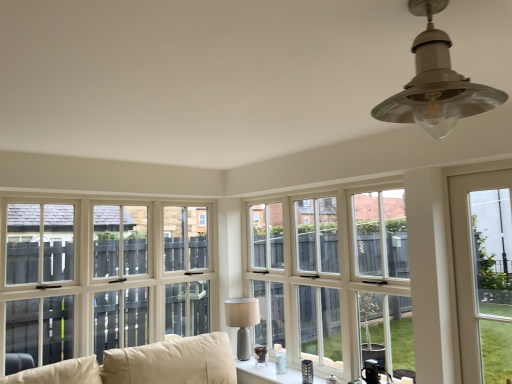
Measure the distance between beige fabric couch at lower left and camera.

A distance of 8.93 feet exists between beige fabric couch at lower left and camera.

This screenshot has width=512, height=384. What do you see at coordinates (145, 365) in the screenshot?
I see `beige fabric couch at lower left` at bounding box center [145, 365].

What is the approximate width of clear glass door at right, the 1th window viewed from the right?

It is 1.63 inches.

Find the location of a particular element. The image size is (512, 384). matte gray lamp at center, acting as the first lamp starting from the bottom is located at coordinates (242, 322).

Based on the photo, is white glossy windowsill at center, marked as the third window in a right-to-left arrangement, positioned behind matte gray lamp at center, the 1th lamp when ordered from back to front?

No, it is in front of matte gray lamp at center, the 1th lamp when ordered from back to front.

Considering the sizes of objects white glossy windowsill at center, marked as the third window in a right-to-left arrangement, and matte gray lamp at center, which ranks as the second lamp in front-to-back order, in the image provided, who is smaller, white glossy windowsill at center, marked as the third window in a right-to-left arrangement, or matte gray lamp at center, which ranks as the second lamp in front-to-back order,?

Smaller between the two is white glossy windowsill at center, marked as the third window in a right-to-left arrangement.

Are white glossy windowsill at center, placed as the first window when sorted from left to right, and matte gray lamp at center, the 2th lamp in the right-to-left sequence, far apart?

That's not correct — white glossy windowsill at center, placed as the first window when sorted from left to right, is a little close to matte gray lamp at center, the 2th lamp in the right-to-left sequence.

Which is less distant, (271, 380) or (248, 345)?

Point (271, 380)

Can you confirm if beige fabric couch at lower left is bigger than matte gray lamp at center, acting as the first lamp starting from the bottom?

Yes.

From their relative heights in the image, would you say beige fabric couch at lower left is taller or shorter than matte gray lamp at center, which is the second lamp from top to bottom?

In the image, beige fabric couch at lower left appears to be shorter than matte gray lamp at center, which is the second lamp from top to bottom.

Is beige fabric couch at lower left aimed at matte gray lamp at center, acting as the first lamp starting from the bottom?

No, beige fabric couch at lower left is not facing towards matte gray lamp at center, acting as the first lamp starting from the bottom.

Is the position of matte gray lamp at center, which is the second lamp from top to bottom, less distant than that of white glossy windowsill at center, placed as the first window when sorted from left to right?

No, it is not.

Is matte gray lamp at center, the 1th lamp when ordered from back to front, aimed at white glossy windowsill at center, marked as the third window in a right-to-left arrangement?

Yes, matte gray lamp at center, the 1th lamp when ordered from back to front, is turned towards white glossy windowsill at center, marked as the third window in a right-to-left arrangement.

Who is taller, matte gray lamp at center, acting as the first lamp starting from the bottom, or white glossy windowsill at center, placed as the first window when sorted from left to right?

matte gray lamp at center, acting as the first lamp starting from the bottom.

From the image's perspective, starting from the white glossy windowsill at center, marked as the third window in a right-to-left arrangement, which lamp is the 1st one above? Please provide its 2D coordinates.

[(242, 322)]

Is white wood window at center, which appears as the second window when viewed from the right, bigger or smaller than matte gray lamp at center, the 1th lamp when ordered from back to front?

white wood window at center, which appears as the second window when viewed from the right, is bigger than matte gray lamp at center, the 1th lamp when ordered from back to front.

How distant is white wood window at center, which appears as the second window when viewed from the right, from matte gray lamp at center, acting as the first lamp starting from the bottom?

white wood window at center, which appears as the second window when viewed from the right, and matte gray lamp at center, acting as the first lamp starting from the bottom, are 66.67 centimeters apart.

Considering the relative sizes of white wood window at center, acting as the 2th window starting from the left, and matte gray lamp at center, the 1th lamp when ordered from back to front, in the image provided, is white wood window at center, acting as the 2th window starting from the left, taller than matte gray lamp at center, the 1th lamp when ordered from back to front,?

Yes, white wood window at center, acting as the 2th window starting from the left, is taller than matte gray lamp at center, the 1th lamp when ordered from back to front.

Could you tell me if white wood window at center, which appears as the second window when viewed from the right, is turned towards matte gray lamp at center, the 1th lamp when ordered from back to front?

Yes, white wood window at center, which appears as the second window when viewed from the right, is oriented towards matte gray lamp at center, the 1th lamp when ordered from back to front.

Considering the relative sizes of satin silver lampshade at upper center, the 1th lamp when ordered from right to left, and clear glass door at right, arranged as the 3th window when viewed from the left, in the image provided, is satin silver lampshade at upper center, the 1th lamp when ordered from right to left, wider than clear glass door at right, arranged as the 3th window when viewed from the left,?

Yes.

Does satin silver lampshade at upper center, placed as the first lamp when sorted from top to bottom, appear on the left side of clear glass door at right, the 1th window viewed from the right?

Indeed, satin silver lampshade at upper center, placed as the first lamp when sorted from top to bottom, is positioned on the left side of clear glass door at right, the 1th window viewed from the right.

Is satin silver lampshade at upper center, the 1th lamp viewed from the front, facing towards clear glass door at right, arranged as the 3th window when viewed from the left?

No, satin silver lampshade at upper center, the 1th lamp viewed from the front, is not turned towards clear glass door at right, arranged as the 3th window when viewed from the left.

Is point (327, 327) behind point (139, 369)?

Yes, point (327, 327) is behind point (139, 369).

From the picture: Do you think white wood window at center, acting as the 2th window starting from the left, is within beige fabric couch at lower left, or outside of it?

white wood window at center, acting as the 2th window starting from the left, lies outside beige fabric couch at lower left.

Considering the sizes of white wood window at center, which appears as the second window when viewed from the right, and beige fabric couch at lower left in the image, is white wood window at center, which appears as the second window when viewed from the right, wider or thinner than beige fabric couch at lower left?

white wood window at center, which appears as the second window when viewed from the right, is thinner than beige fabric couch at lower left.

From a real-world perspective, who is located lower, white wood window at center, which appears as the second window when viewed from the right, or beige fabric couch at lower left?

From a 3D spatial view, beige fabric couch at lower left is below.

Is the depth of clear glass door at right, the 1th window viewed from the right, greater than that of beige fabric couch at lower left?

Yes, it is.

Would you say clear glass door at right, the 1th window viewed from the right, is outside beige fabric couch at lower left?

clear glass door at right, the 1th window viewed from the right, lies outside beige fabric couch at lower left's area.

Which is farther, (459, 250) or (158, 381)?

The point (158, 381) is more distant.

From the image's perspective, is clear glass door at right, arranged as the 3th window when viewed from the left, over beige fabric couch at lower left?

Yes, from the image's perspective, clear glass door at right, arranged as the 3th window when viewed from the left, is over beige fabric couch at lower left.

The image size is (512, 384). Find the location of `the 1st window to the right of the matte gray lamp at center, acting as the first lamp starting from the bottom, counting from the anchor's position`. the 1st window to the right of the matte gray lamp at center, acting as the first lamp starting from the bottom, counting from the anchor's position is located at coordinates (265, 374).

This screenshot has height=384, width=512. What are the coordinates of `studio couch lying on the left of matte gray lamp at center, which is the second lamp from top to bottom` in the screenshot? It's located at (145, 365).

Looking at the image, which one is located closer to beige fabric couch at lower left, white wood window at center, which appears as the second window when viewed from the right, or satin silver lampshade at upper center, the second lamp in the bottom-to-top sequence?

The object closer to beige fabric couch at lower left is white wood window at center, which appears as the second window when viewed from the right.

From the image, which object appears to be nearer to satin silver lampshade at upper center, placed as the first lamp when sorted from top to bottom, matte gray lamp at center, the 2th lamp in the right-to-left sequence, or white glossy windowsill at center, marked as the third window in a right-to-left arrangement?

The object closer to satin silver lampshade at upper center, placed as the first lamp when sorted from top to bottom, is white glossy windowsill at center, marked as the third window in a right-to-left arrangement.

From the image, which object appears to be farther from white wood window at center, which appears as the second window when viewed from the right, satin silver lampshade at upper center, placed as the first lamp when sorted from top to bottom, or clear glass door at right, arranged as the 3th window when viewed from the left?

satin silver lampshade at upper center, placed as the first lamp when sorted from top to bottom, lies further to white wood window at center, which appears as the second window when viewed from the right, than the other object.

When comparing their distances from white wood window at center, acting as the 2th window starting from the left, does clear glass door at right, arranged as the 3th window when viewed from the left, or white glossy windowsill at center, placed as the first window when sorted from left to right, seem closer?

white glossy windowsill at center, placed as the first window when sorted from left to right, is closer to white wood window at center, acting as the 2th window starting from the left.

Which object lies nearer to the anchor point matte gray lamp at center, which is the second lamp from top to bottom, satin silver lampshade at upper center, the 1th lamp viewed from the front, or clear glass door at right, the 1th window viewed from the right?

clear glass door at right, the 1th window viewed from the right, lies closer to matte gray lamp at center, which is the second lamp from top to bottom, than the other object.

Looking at the image, which one is located closer to satin silver lampshade at upper center, the second lamp in the bottom-to-top sequence, white glossy windowsill at center, placed as the first window when sorted from left to right, or beige fabric couch at lower left?

beige fabric couch at lower left is positioned closer to the anchor satin silver lampshade at upper center, the second lamp in the bottom-to-top sequence.

Considering their positions, is clear glass door at right, the 1th window viewed from the right, positioned closer to white glossy windowsill at center, placed as the first window when sorted from left to right, than beige fabric couch at lower left?

Based on the image, beige fabric couch at lower left appears to be nearer to white glossy windowsill at center, placed as the first window when sorted from left to right.

Considering their positions, is matte gray lamp at center, acting as the first lamp starting from the bottom, positioned further to white wood window at center, acting as the 2th window starting from the left, than beige fabric couch at lower left?

Among the two, beige fabric couch at lower left is located further to white wood window at center, acting as the 2th window starting from the left.

What are the coordinates of `window between white glossy windowsill at center, marked as the third window in a right-to-left arrangement, and clear glass door at right, the 1th window viewed from the right, from left to right` in the screenshot? It's located at (334, 280).

Find the location of `window located between satin silver lampshade at upper center, the 1th lamp viewed from the front, and white wood window at center, acting as the 2th window starting from the left, in the depth direction`. window located between satin silver lampshade at upper center, the 1th lamp viewed from the front, and white wood window at center, acting as the 2th window starting from the left, in the depth direction is located at coordinates (483, 273).

This screenshot has width=512, height=384. In order to click on studio couch positioned between satin silver lampshade at upper center, placed as the first lamp when sorted from top to bottom, and white glossy windowsill at center, marked as the third window in a right-to-left arrangement, from near to far in this screenshot , I will do `click(145, 365)`.

Where is `studio couch between satin silver lampshade at upper center, placed as the first lamp when sorted from top to bottom, and white wood window at center, which appears as the second window when viewed from the right, from front to back`? studio couch between satin silver lampshade at upper center, placed as the first lamp when sorted from top to bottom, and white wood window at center, which appears as the second window when viewed from the right, from front to back is located at coordinates (145, 365).